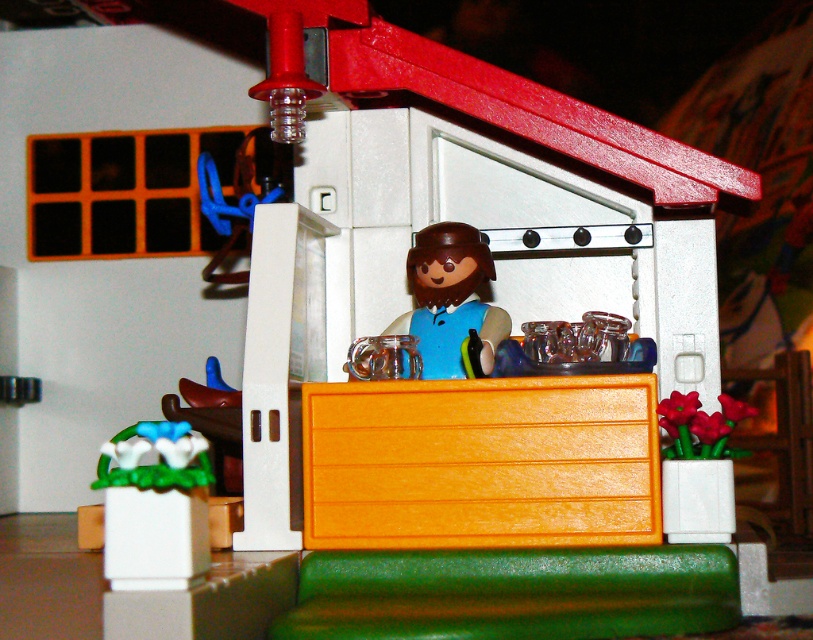
What is located at the point with coordinates (481,461) in the image?

The point at coordinates (481,461) corresponds to the orange matte drawer at center.

You are a customer at the shop and want to place an order. Where exactly is the orange matte drawer at center located in the shop?

The orange matte drawer at center is located at point (481, 461) in the shop.

Looking at this image, you are setting up a Playmobil scene and have to place the orange matte drawer at center and the white glossy flower pot at lower left on the counter. If the counter has limited space, which object should you place first to ensure both fit?

The orange matte drawer at center is wider than the white glossy flower pot at lower left, so you should place the white glossy flower pot at lower left first to accommodate the wider drawer afterward.